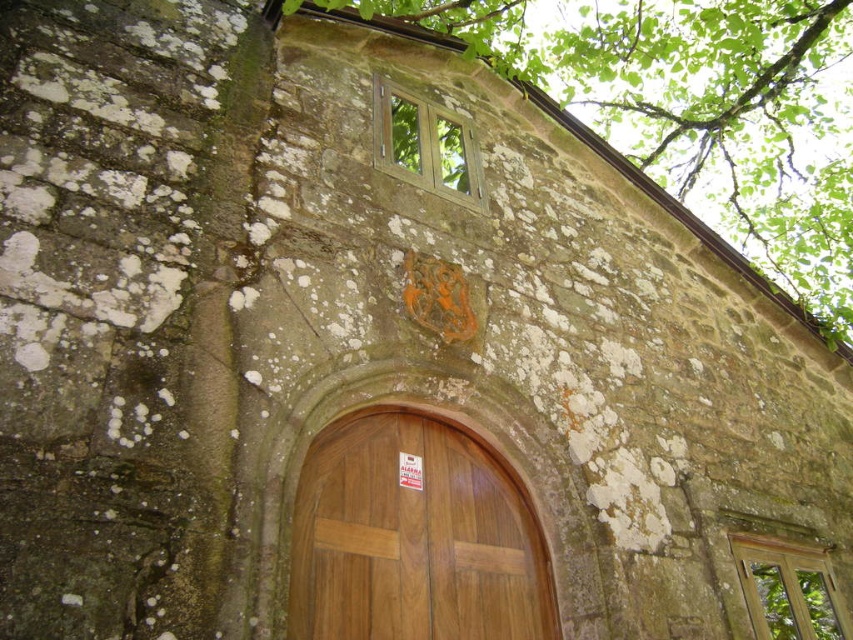
Question: Which point is farther to the camera?

Choices:
 (A) green leafy tree at upper center
 (B) wooden door at center

Answer: (A)

Question: Can you confirm if green leafy tree at upper center is bigger than wooden door at center?

Choices:
 (A) no
 (B) yes

Answer: (B)

Question: Does green leafy tree at upper center appear on the left side of wooden door at center?

Choices:
 (A) yes
 (B) no

Answer: (B)

Question: Is green leafy tree at upper center below wooden door at center?

Choices:
 (A) no
 (B) yes

Answer: (A)

Question: Which of the following is the farthest from the observer?

Choices:
 (A) (834, 298)
 (B) (367, 595)

Answer: (A)

Question: Which of the following is the closest to the observer?

Choices:
 (A) wooden door at center
 (B) green leafy tree at upper center

Answer: (A)